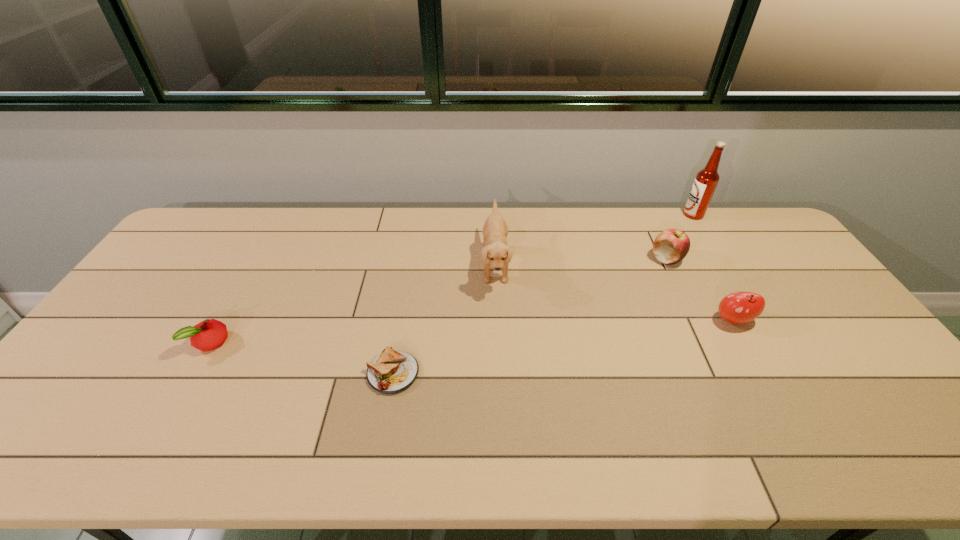
Where is `vacant space situated on the label side of the tallest object`? vacant space situated on the label side of the tallest object is located at coordinates (605, 214).

Identify the location of free space located on the label side of the tallest object. (616, 214).

The height and width of the screenshot is (540, 960). Identify the location of free location located on the left side of the fourth object from right to left. (364, 265).

This screenshot has width=960, height=540. Find the location of `vacant space situated 0.350m on the left side of the fourth object from right to left`. vacant space situated 0.350m on the left side of the fourth object from right to left is located at coordinates (373, 265).

This screenshot has width=960, height=540. In order to click on free space located on the left side of the fourth object from right to left in this screenshot , I will do (370, 265).

This screenshot has height=540, width=960. In order to click on free location located 0.390m on the front of the farthest apple in this screenshot , I will do `click(720, 372)`.

Image resolution: width=960 pixels, height=540 pixels. I want to click on free region located on the back of the leftmost apple, so click(x=265, y=247).

Identify the location of free region located on the front of the sandwich. (379, 455).

You are a GUI agent. You are given a task and a screenshot of the screen. Output one action in this format:
    pyautogui.click(x=<x>, y=<y>)
    Task: Click on the alcohol positioned at the far edge
    
    Given the screenshot: What is the action you would take?
    pyautogui.click(x=706, y=180)

Locate an element on the screen. puppy located in the far edge section of the desktop is located at coordinates click(495, 251).